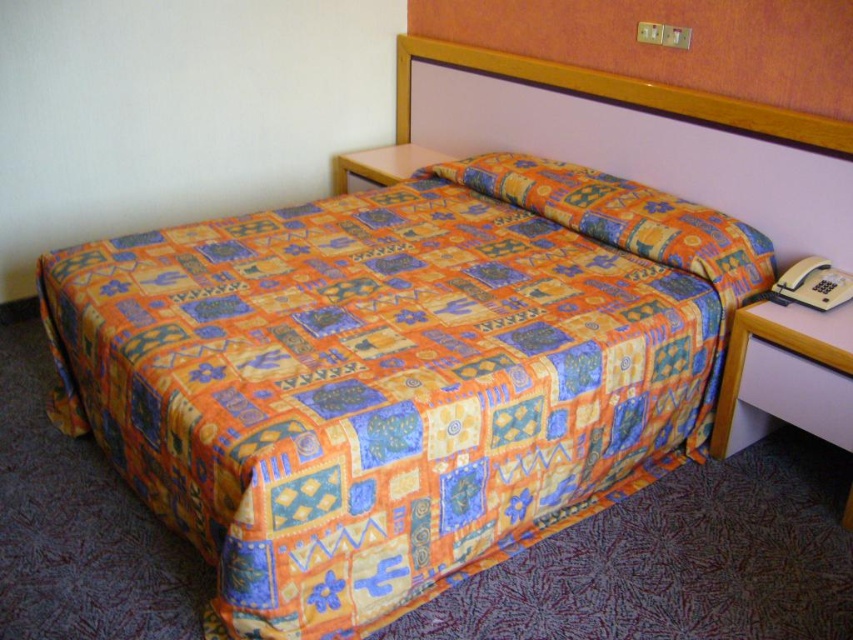
Question: Which object appears farthest from the camera in this image?

Choices:
 (A) printed fabric quilt at center
 (B) orange printed fabric pillow at center

Answer: (B)

Question: Does printed fabric quilt at center appear on the right side of orange printed fabric pillow at center?

Choices:
 (A) no
 (B) yes

Answer: (A)

Question: Can you confirm if printed fabric quilt at center is positioned to the left of orange printed fabric pillow at center?

Choices:
 (A) no
 (B) yes

Answer: (B)

Question: Is printed fabric quilt at center above orange printed fabric pillow at center?

Choices:
 (A) no
 (B) yes

Answer: (A)